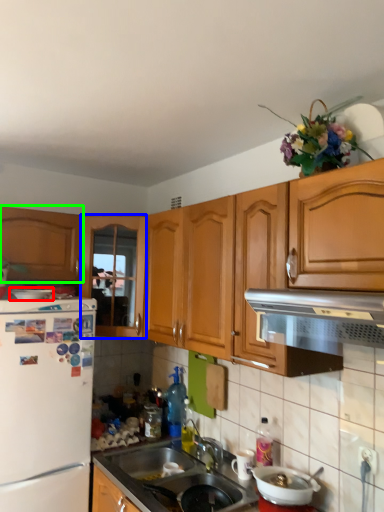
Question: Considering the real-world distances, which object is farthest from appliance (highlighted by a red box)? cabinetry (highlighted by a blue box) or cabinetry (highlighted by a green box)?

Choices:
 (A) cabinetry
 (B) cabinetry

Answer: (A)